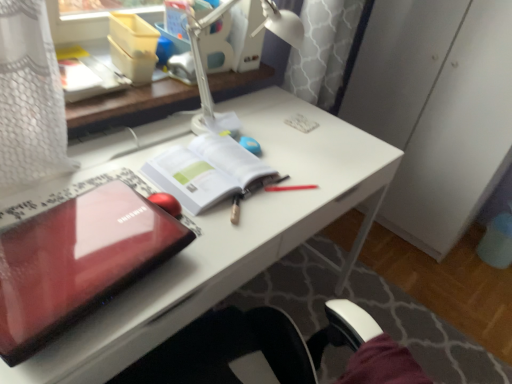
Find the location of a particular element. Image resolution: width=512 pixels, height=384 pixels. vacant space behind white paper at center is located at coordinates (245, 132).